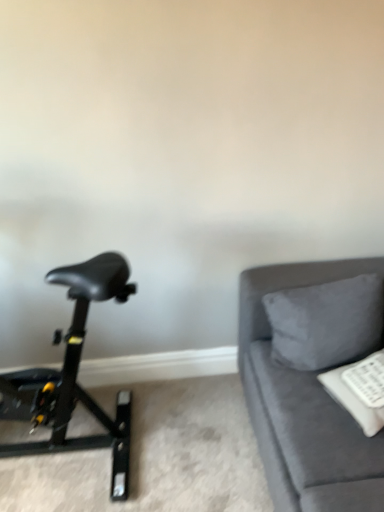
Question: Should I look upward or downward to see suede gray pillow at right?

Choices:
 (A) down
 (B) up

Answer: (A)

Question: Is black matte stationary bicycle at left positioned with its back to velvet gray couch at right?

Choices:
 (A) no
 (B) yes

Answer: (A)

Question: Is black matte stationary bicycle at left at the left side of velvet gray couch at right?

Choices:
 (A) yes
 (B) no

Answer: (A)

Question: Is black matte stationary bicycle at left taller than velvet gray couch at right?

Choices:
 (A) no
 (B) yes

Answer: (B)

Question: Does black matte stationary bicycle at left have a greater width compared to velvet gray couch at right?

Choices:
 (A) no
 (B) yes

Answer: (A)

Question: From the image's perspective, would you say black matte stationary bicycle at left is positioned over velvet gray couch at right?

Choices:
 (A) yes
 (B) no

Answer: (A)

Question: Is velvet gray couch at right a part of black matte stationary bicycle at left?

Choices:
 (A) no
 (B) yes

Answer: (A)

Question: Is suede gray pillow at right facing away from black matte stationary bicycle at left?

Choices:
 (A) no
 (B) yes

Answer: (A)

Question: Is black matte stationary bicycle at left located within suede gray pillow at right?

Choices:
 (A) no
 (B) yes

Answer: (A)

Question: From the image's perspective, is suede gray pillow at right beneath black matte stationary bicycle at left?

Choices:
 (A) no
 (B) yes

Answer: (A)

Question: Are suede gray pillow at right and black matte stationary bicycle at left beside each other?

Choices:
 (A) no
 (B) yes

Answer: (A)

Question: Can you confirm if suede gray pillow at right is bigger than black matte stationary bicycle at left?

Choices:
 (A) yes
 (B) no

Answer: (B)

Question: From a real-world perspective, is suede gray pillow at right located beneath black matte stationary bicycle at left?

Choices:
 (A) no
 (B) yes

Answer: (B)

Question: Considering the relative sizes of velvet gray couch at right and suede gray pillow at right in the image provided, is velvet gray couch at right thinner than suede gray pillow at right?

Choices:
 (A) no
 (B) yes

Answer: (A)